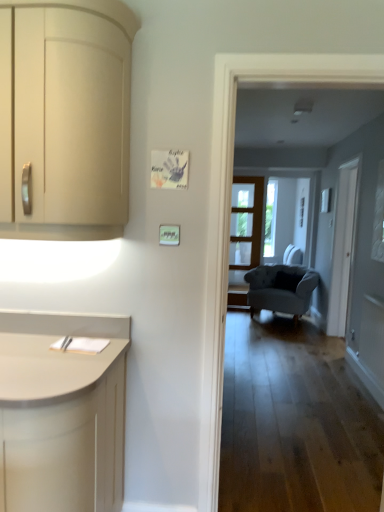
Question: Considering the relative sizes of white glass screen door at right and velvet grey armchair at center in the image provided, is white glass screen door at right bigger than velvet grey armchair at center?

Choices:
 (A) yes
 (B) no

Answer: (B)

Question: From a real-world perspective, is white glass screen door at right positioned under velvet grey armchair at center based on gravity?

Choices:
 (A) no
 (B) yes

Answer: (A)

Question: From the image's perspective, is white glass screen door at right below velvet grey armchair at center?

Choices:
 (A) yes
 (B) no

Answer: (B)

Question: Is white glass screen door at right in contact with velvet grey armchair at center?

Choices:
 (A) yes
 (B) no

Answer: (B)

Question: Could you tell me if white glass screen door at right is turned towards velvet grey armchair at center?

Choices:
 (A) yes
 (B) no

Answer: (B)

Question: Would you say white glass screen door at right is a long distance from velvet grey armchair at center?

Choices:
 (A) yes
 (B) no

Answer: (A)

Question: Would you say white glass screen door at right is outside matte cream cabinet at left?

Choices:
 (A) yes
 (B) no

Answer: (A)

Question: Can you confirm if white glass screen door at right is smaller than matte cream cabinet at left?

Choices:
 (A) no
 (B) yes

Answer: (A)

Question: From the image's perspective, is white glass screen door at right on top of matte cream cabinet at left?

Choices:
 (A) no
 (B) yes

Answer: (A)

Question: Is white glass screen door at right bigger than matte cream cabinet at left?

Choices:
 (A) no
 (B) yes

Answer: (B)

Question: From the image's perspective, is white glass screen door at right located beneath matte cream cabinet at left?

Choices:
 (A) yes
 (B) no

Answer: (A)

Question: Is white glass screen door at right closer to camera compared to matte cream cabinet at left?

Choices:
 (A) no
 (B) yes

Answer: (A)

Question: Can you confirm if velvet grey armchair at center is positioned to the left of clear glass door at center?

Choices:
 (A) yes
 (B) no

Answer: (B)